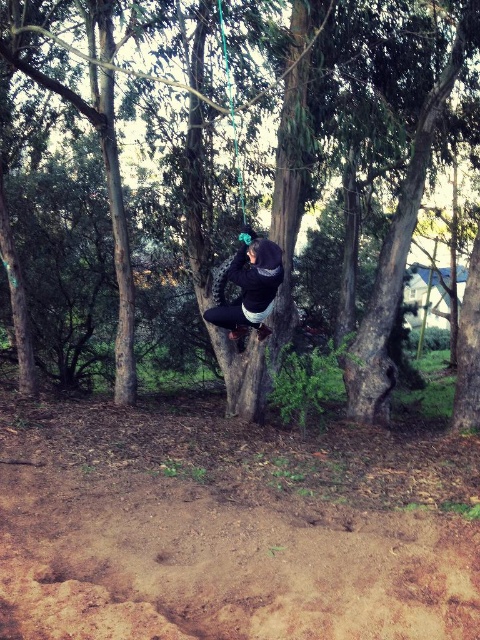
How far apart are brown dirt track at lower center and dark blue fleece jacket at center?

1.99 meters

Which is behind, point (187, 557) or point (253, 305)?

The point (253, 305) is behind.

Is point (264, 451) positioned after point (262, 324)?

No, (264, 451) is in front of (262, 324).

Locate an element on the screen. brown dirt track at lower center is located at coordinates (230, 528).

Who is taller, brown dirt track at lower center or brown rough tree trunk at center?

brown rough tree trunk at center is taller.

Between brown dirt track at lower center and brown rough tree trunk at center, which one appears on the right side from the viewer's perspective?

brown rough tree trunk at center

Does point (94, 634) come closer to viewer compared to point (428, 108)?

Yes, it is in front of point (428, 108).

This screenshot has height=640, width=480. I want to click on brown dirt track at lower center, so click(230, 528).

Does brown rough tree trunk at center have a greater width compared to dark blue fleece jacket at center?

Incorrect, brown rough tree trunk at center's width does not surpass dark blue fleece jacket at center's.

Where is `brown rough tree trunk at center`? This screenshot has width=480, height=640. brown rough tree trunk at center is located at coordinates (402, 241).